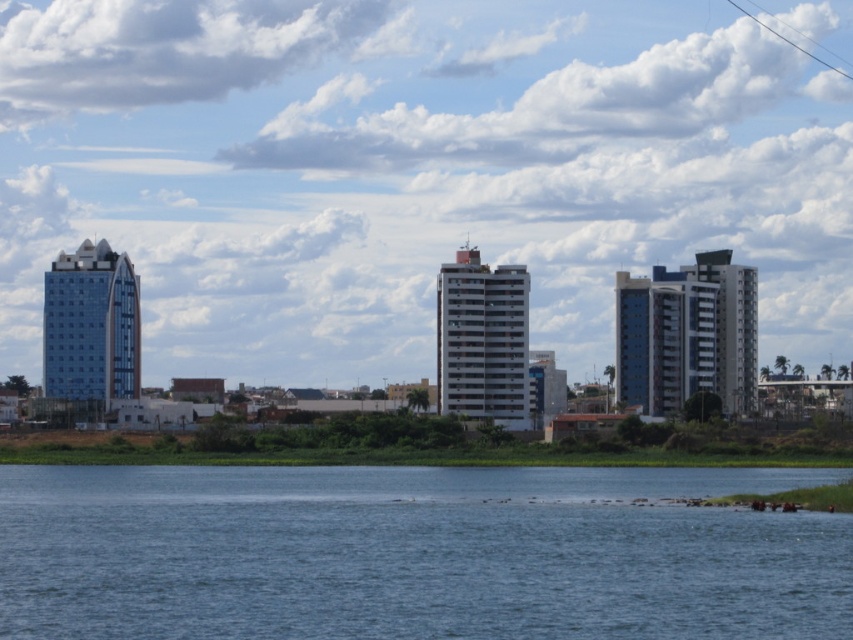
You are a boat captain planning to navigate a vessel with a 20m width through the space between the blue water at lower center and the glassy blue skyscraper at left. Can your boat fit through the space?

The blue water at lower center is wider than the glassy blue skyscraper at left, so the boat with a 20m width can fit through the space as long as the width of the water is sufficient to accommodate the boat.

You are a tourist standing on the small strip of land with green vegetation. You want to take a photo that includes both the glassy blue skyscraper at left and the white smooth building at center. Which building should you position closer to the edge of the water to include both in your frame?

To include both the glassy blue skyscraper at left and the white smooth building at center in your photo, you should position yourself closer to the edge of the water near the glassy blue skyscraper at left since it is larger and will require a wider angle to capture both buildings in the frame.

You are a photographer standing at the water edge. You want to capture both the blue water at lower center and the blue glass building at right in your shot. Which object will appear larger in the photo?

The blue water at lower center will appear larger in the photo because it is closer to the viewer than the blue glass building at right.